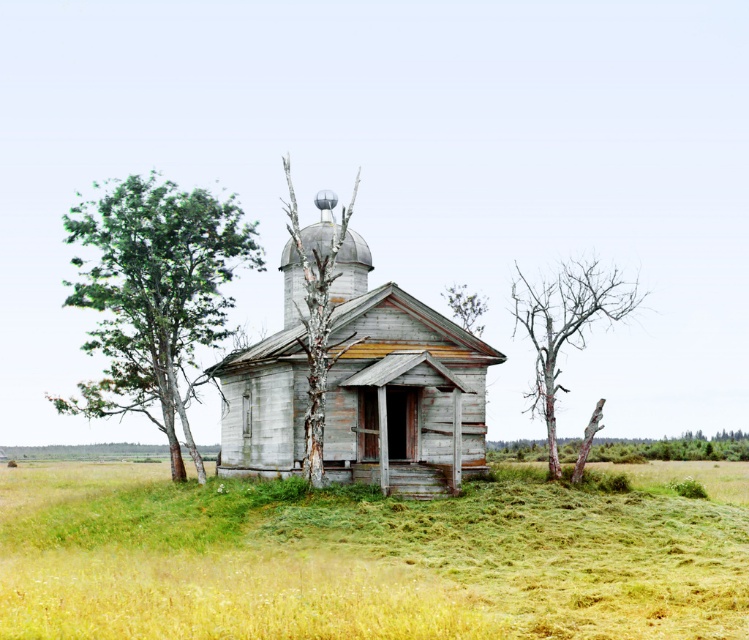
Question: Which of the following is the closest to the observer?

Choices:
 (A) (63, 224)
 (B) (1, 474)
 (C) (403, 468)

Answer: (C)

Question: Is weathered wood church at center positioned behind green leafy tree at left?

Choices:
 (A) no
 (B) yes

Answer: (A)

Question: In this image, where is green grassy field at center located relative to green leafy tree at left?

Choices:
 (A) above
 (B) below

Answer: (B)

Question: Which of these objects is positioned farthest from the bare wood tree at right?

Choices:
 (A) green leafy tree at left
 (B) weathered wood church at center
 (C) green grassy field at center

Answer: (A)

Question: Is weathered wood church at center further to the viewer compared to bare wood tree at right?

Choices:
 (A) no
 (B) yes

Answer: (A)

Question: Which point is closer to the camera?

Choices:
 (A) (266, 346)
 (B) (84, 342)
 (C) (392, 541)
 (D) (524, 332)

Answer: (C)